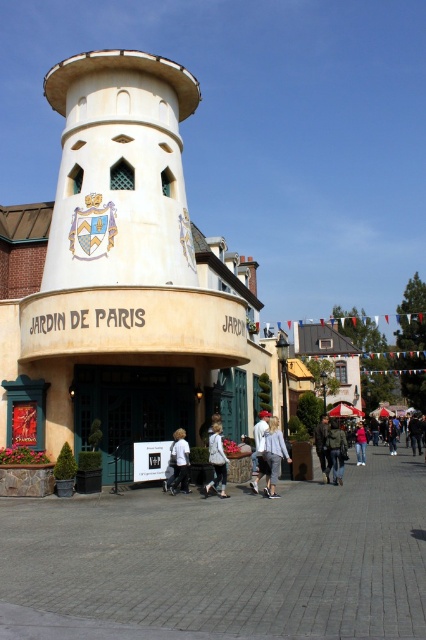
Question: Can you confirm if white cotton jacket at center is smaller than dark brown leather jacket at center?

Choices:
 (A) no
 (B) yes

Answer: (B)

Question: Based on their relative distances, which object is farther from the white shirt at center?

Choices:
 (A) khaki fabric jacket at center
 (B) pink fabric jacket at center
 (C) dark brown leather jacket at center
 (D) white matte shirt at center

Answer: (B)

Question: Considering the relative positions of light blue denim jeans at center and white shirt at center in the image provided, where is light blue denim jeans at center located with respect to white shirt at center?

Choices:
 (A) left
 (B) right

Answer: (B)

Question: Does white shirt at center have a smaller size compared to pink fabric jacket at center?

Choices:
 (A) no
 (B) yes

Answer: (B)

Question: Among these points, which one is farthest from the camera?

Choices:
 (A) (262, 442)
 (B) (215, 429)
 (C) (203, 275)

Answer: (C)

Question: Which point appears closest to the camera in this image?

Choices:
 (A) pyautogui.click(x=365, y=442)
 (B) pyautogui.click(x=259, y=422)
 (C) pyautogui.click(x=178, y=474)

Answer: (C)